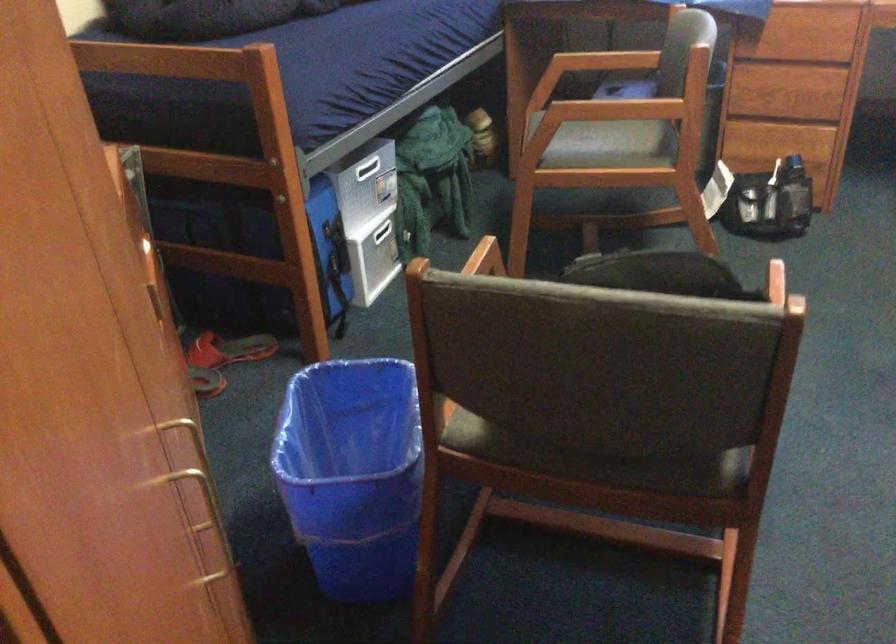
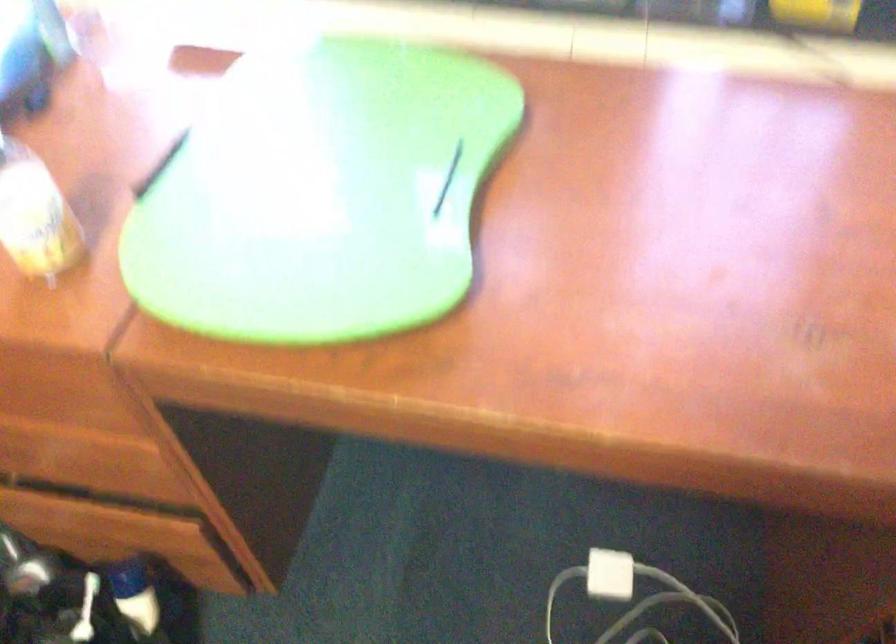
In a continuous first-person perspective shot, in which direction is the camera moving?

The cameraman walked toward right, forward.